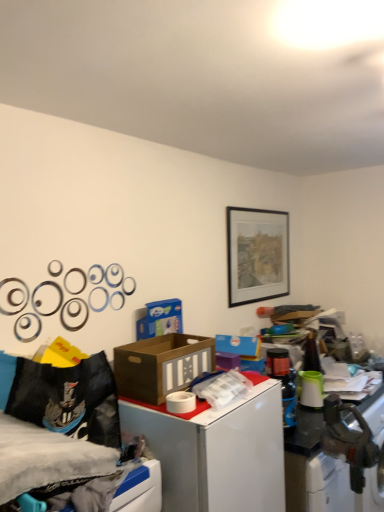
Question: Relative to brown cardboard box at center, is black fabric bed at lower left in front or behind?

Choices:
 (A) behind
 (B) front

Answer: (B)

Question: Is black fabric bed at lower left inside the boundaries of brown cardboard box at center, or outside?

Choices:
 (A) inside
 (B) outside

Answer: (B)

Question: Considering the real-world distances, which object is farthest from the black fabric bed at lower left?

Choices:
 (A) metallic silver washing machine at lower right
 (B) black matte picture frame at upper center
 (C) brown cardboard box at center
 (D) white cardboard box at upper right

Answer: (B)

Question: Considering the real-world distances, which object is closest to the metallic silver washing machine at lower right?

Choices:
 (A) brown cardboard box at center
 (B) black fabric bed at lower left
 (C) black matte picture frame at upper center
 (D) white cardboard box at upper right

Answer: (D)